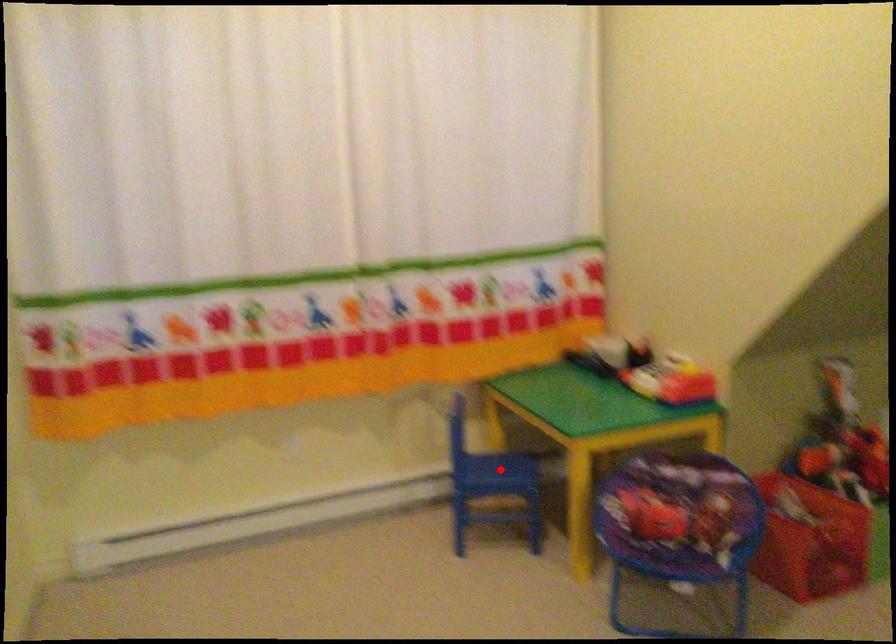
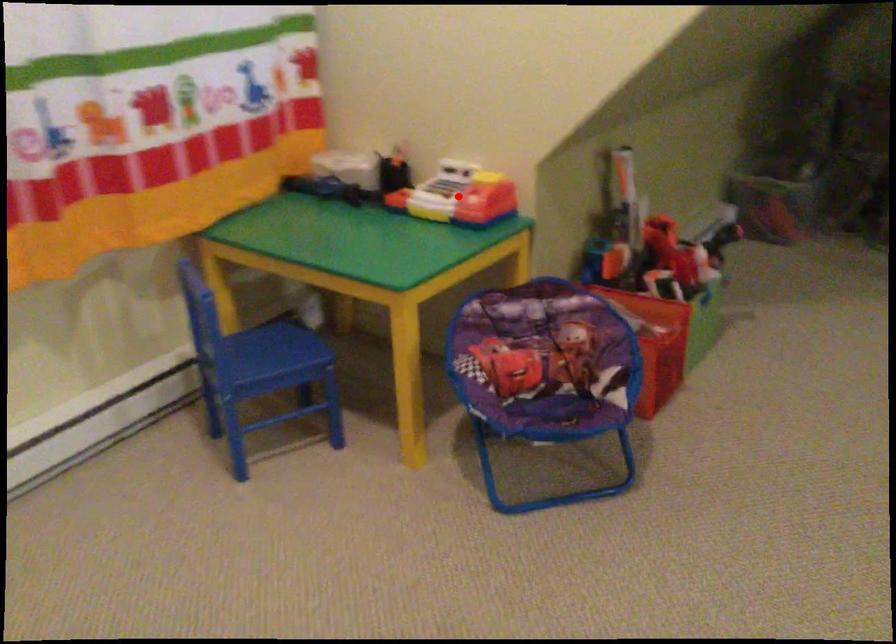
I am providing you with two images of the same scene from different viewpoints. A red point is marked on the first image and another point is marked on the second image. Is the red point in image1 aligned with the point shown in image2?

No